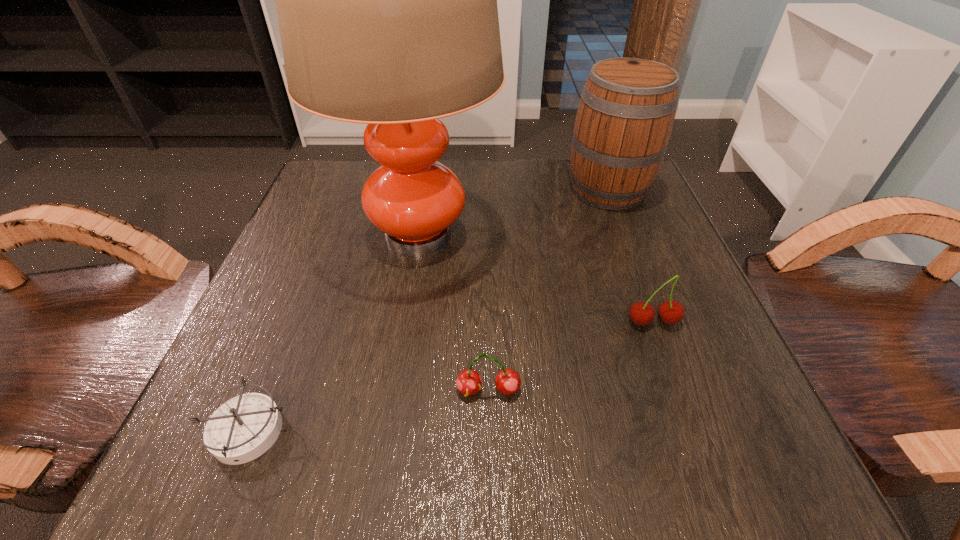
Locate an element on the screen. Image resolution: width=960 pixels, height=540 pixels. object located at the far right corner is located at coordinates (627, 108).

Locate an element on the screen. vacant position at the far edge of the desktop is located at coordinates (483, 187).

This screenshot has width=960, height=540. In the image, there is a desktop. What are the coordinates of `free space at the left edge` in the screenshot? It's located at (292, 262).

Locate an element on the screen. The width and height of the screenshot is (960, 540). vacant space at the right edge of the desktop is located at coordinates (651, 265).

Find the location of a particular element. The height and width of the screenshot is (540, 960). blank area at the far left corner is located at coordinates (318, 207).

I want to click on free space at the far right corner of the desktop, so click(655, 212).

The width and height of the screenshot is (960, 540). Identify the location of free spot between the shortest object and the fourth shortest object. (428, 310).

The height and width of the screenshot is (540, 960). I want to click on vacant area that lies between the left cherry and the shortest object, so pyautogui.click(x=369, y=410).

Locate an element on the screen. This screenshot has height=540, width=960. free point between the shorter cherry and the compass is located at coordinates (369, 410).

The image size is (960, 540). What are the coordinates of `vacant area that lies between the fourth shortest object and the left cherry` in the screenshot? It's located at (548, 289).